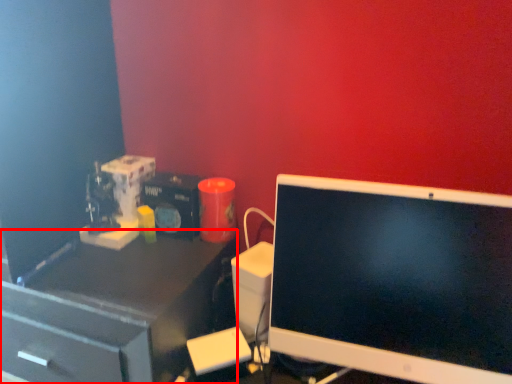
Question: Considering the relative positions of desk (annotated by the red box) and computer monitor in the image provided, where is desk (annotated by the red box) located with respect to the staircase?

Choices:
 (A) right
 (B) left

Answer: (B)